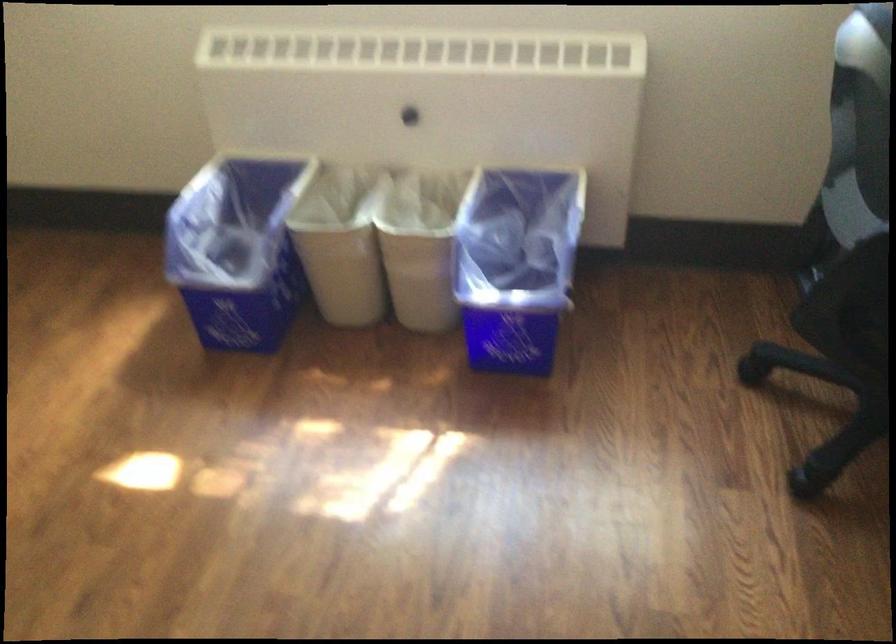
Where would you pull the chair armrest? Please return your answer as a coordinate pair (x, y).

(848, 247)